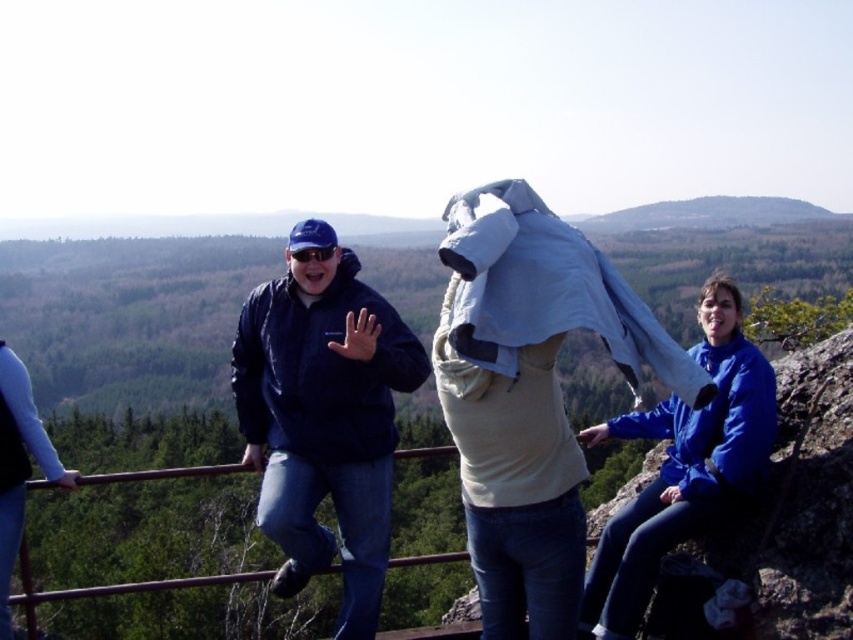
Can you confirm if matte blue jacket at center is thinner than blue fleece jacket at upper right?

No.

Which is below, matte blue jacket at center or blue fleece jacket at upper right?

Positioned lower is matte blue jacket at center.

Is point (379, 509) positioned in front of point (734, 490)?

No.

Find the location of a particular element. This screenshot has height=640, width=853. matte blue jacket at center is located at coordinates (323, 416).